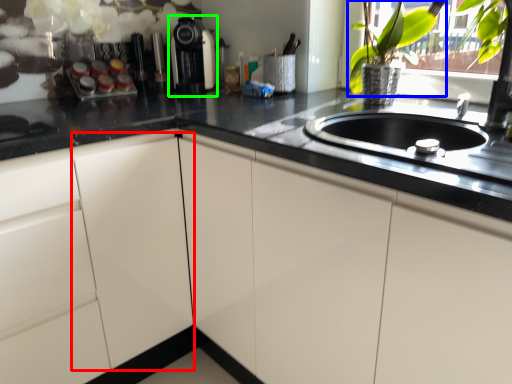
Question: Estimate the real-world distances between objects in this image. Which object is closer to cabinetry (highlighted by a red box), floral arrangement (highlighted by a blue box) or coffee machine (highlighted by a green box)?

Choices:
 (A) floral arrangement
 (B) coffee machine

Answer: (B)